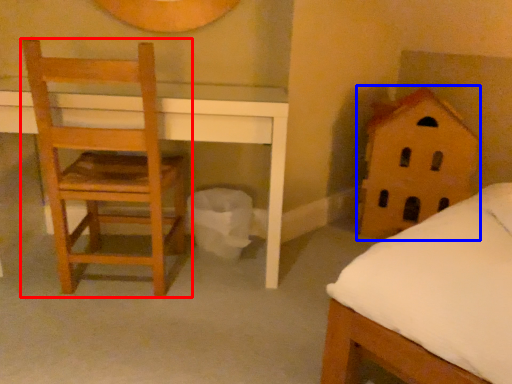
Question: Which object is further to the camera taking this photo, chair (highlighted by a red box) or toy (highlighted by a blue box)?

Choices:
 (A) chair
 (B) toy

Answer: (B)